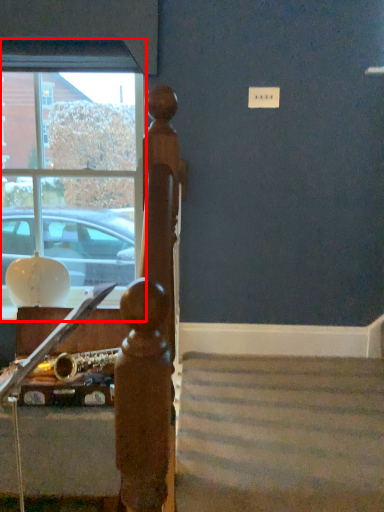
Question: In this image, where is window (annotated by the red box) located relative to furniture?

Choices:
 (A) left
 (B) right

Answer: (A)